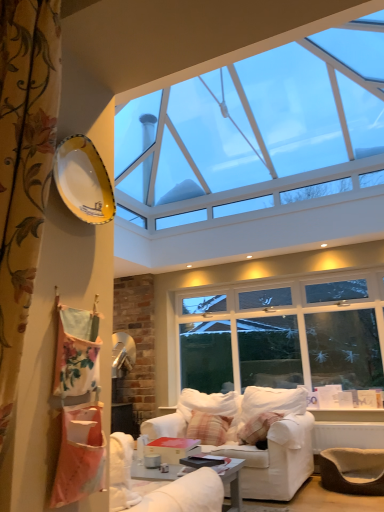
Question: Which is correct: plaid fabric pillow at center is inside yellow glossy plate at upper left, or outside of it?

Choices:
 (A) outside
 (B) inside

Answer: (A)

Question: From their relative heights in the image, would you say plaid fabric pillow at center is taller or shorter than yellow glossy plate at upper left?

Choices:
 (A) short
 (B) tall

Answer: (B)

Question: Which object is positioned closest to the white fabric couch at center?

Choices:
 (A) plaid fabric pillow at center
 (B) floral fabric curtain at left
 (C) transparent glass window at upper center
 (D) yellow glossy plate at upper left
 (E) brown woven armchair at lower right

Answer: (A)

Question: Which object is the closest to the yellow glossy plate at upper left?

Choices:
 (A) brown woven armchair at lower right
 (B) floral fabric curtain at left
 (C) transparent glass window at upper center
 (D) white fabric couch at center
 (E) plaid fabric pillow at center

Answer: (B)